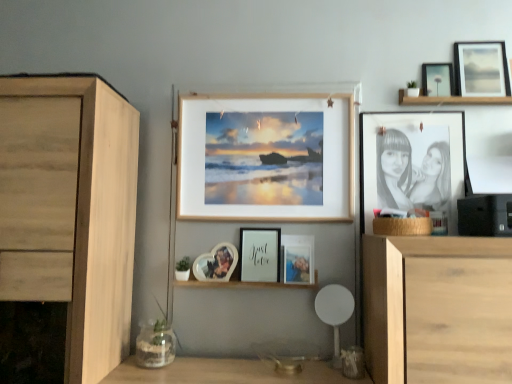
Question: Should I look upward or downward to see wooden frame at center, the fifth picture frame from the right?

Choices:
 (A) down
 (B) up

Answer: (B)

Question: Is the surface of clear glass vase at lower left in direct contact with white plastic chair at lower center?

Choices:
 (A) yes
 (B) no

Answer: (B)

Question: Considering the relative positions of clear glass vase at lower left and white plastic chair at lower center in the image provided, is clear glass vase at lower left in front of white plastic chair at lower center?

Choices:
 (A) no
 (B) yes

Answer: (B)

Question: Is clear glass vase at lower left facing towards white plastic chair at lower center?

Choices:
 (A) yes
 (B) no

Answer: (B)

Question: Is clear glass vase at lower left smaller than white plastic chair at lower center?

Choices:
 (A) yes
 (B) no

Answer: (B)

Question: Does clear glass vase at lower left have a greater height compared to white plastic chair at lower center?

Choices:
 (A) no
 (B) yes

Answer: (A)

Question: From a real-world perspective, does clear glass vase at lower left stand above white plastic chair at lower center?

Choices:
 (A) no
 (B) yes

Answer: (A)

Question: Can you confirm if matte black picture frame at upper right, the second picture frame from the right, is bigger than clear glass vase at lower left?

Choices:
 (A) yes
 (B) no

Answer: (B)

Question: Is matte black picture frame at upper right, the 6th picture frame in the left-to-right sequence, not within clear glass vase at lower left?

Choices:
 (A) yes
 (B) no

Answer: (A)

Question: Does matte black picture frame at upper right, the 6th picture frame in the left-to-right sequence, come in front of clear glass vase at lower left?

Choices:
 (A) no
 (B) yes

Answer: (A)

Question: From the image's perspective, is matte black picture frame at upper right, the 6th picture frame in the left-to-right sequence, located beneath clear glass vase at lower left?

Choices:
 (A) yes
 (B) no

Answer: (B)

Question: Does matte black picture frame at upper right, the second picture frame from the right, have a greater height compared to clear glass vase at lower left?

Choices:
 (A) no
 (B) yes

Answer: (A)

Question: From a real-world perspective, is matte black picture frame at upper right, the 6th picture frame in the left-to-right sequence, physically below clear glass vase at lower left?

Choices:
 (A) yes
 (B) no

Answer: (B)

Question: Is clear glass vase at lower left located outside matte black picture frame at upper right, the second picture frame from the right?

Choices:
 (A) yes
 (B) no

Answer: (A)